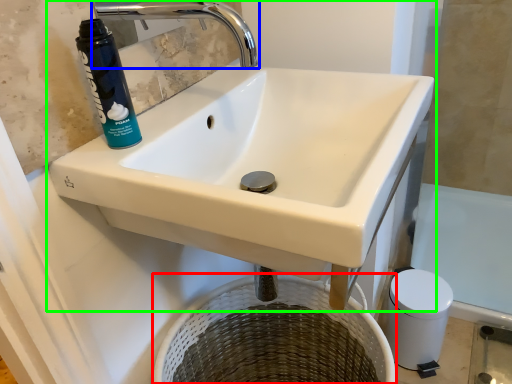
Question: Estimate the real-world distances between objects in this image. Which object is closer to basket (highlighted by a red box), tap (highlighted by a blue box) or sink (highlighted by a green box)?

Choices:
 (A) tap
 (B) sink

Answer: (B)